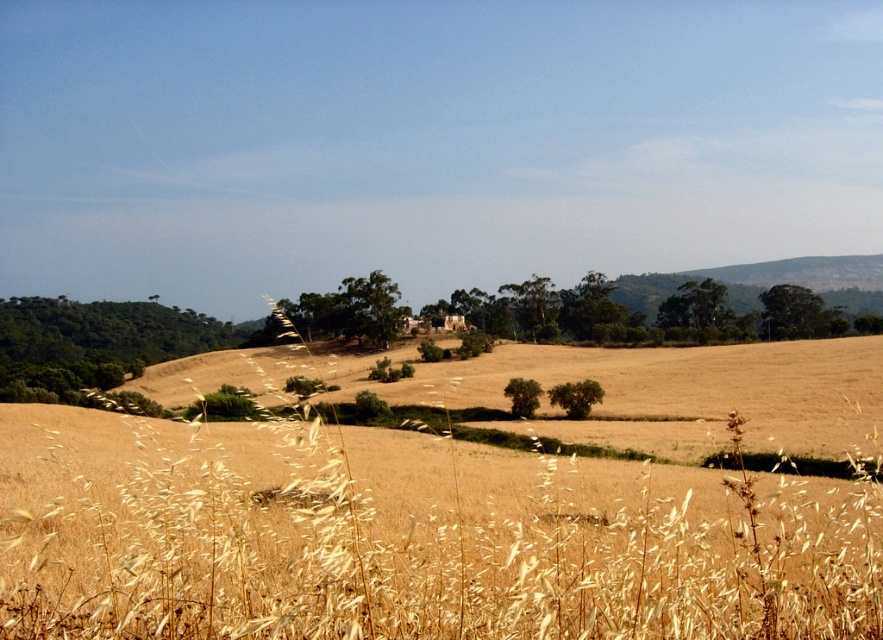
You are standing in the rural landscape and want to walk towards the golden dry grass at center and the green leafy tree at left. Which object will you reach first?

You will reach the golden dry grass at center first because it is closer to the viewer than the green leafy tree at left.

Looking at this image, you are standing in the rural landscape and want to walk from the green leafy tree at left to the golden dry grass at center. Which direction should you face before stepping forward?

You should face to the right because the golden dry grass at center is to the right of the green leafy tree at left.

You are standing at the point marked by coordinates [451,506] in the image. Looking around, you see golden dry grass at center. Which direction would you face to see the golden dry grass at center?

You are already standing at the golden dry grass at center, which is represented by the point [451,506]. Therefore, you don not need to face any particular direction to see it.